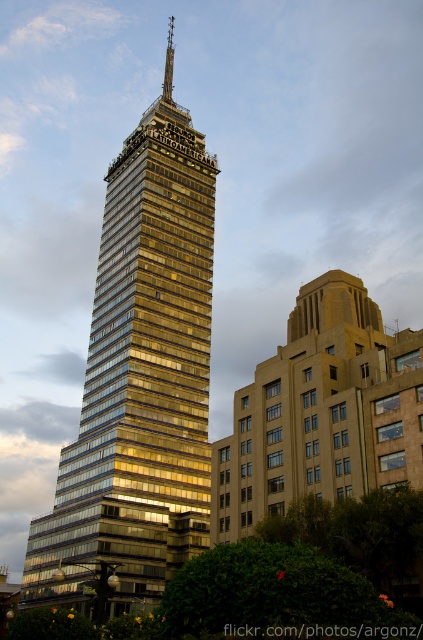
Question: Is the position of gold glassy building at center more distant than that of shiny metallic spire at center?

Choices:
 (A) yes
 (B) no

Answer: (B)

Question: Can you confirm if gold glassy building at center is wider than shiny metallic spire at center?

Choices:
 (A) no
 (B) yes

Answer: (B)

Question: Which point is farther from the camera taking this photo?

Choices:
 (A) (164, 88)
 (B) (129, 586)

Answer: (A)

Question: Is gold glassy building at center wider than shiny metallic spire at center?

Choices:
 (A) yes
 (B) no

Answer: (A)